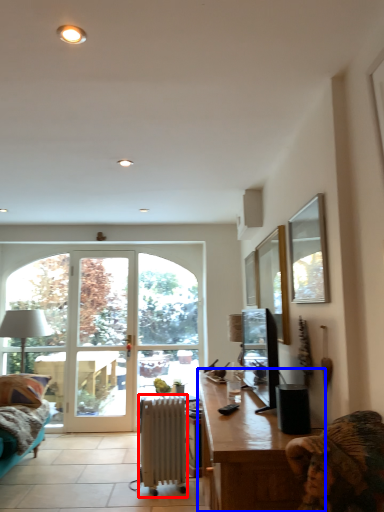
Question: Which point is closer to the camera, radiator (highlighted by a red box) or desk (highlighted by a blue box)?

Choices:
 (A) radiator
 (B) desk

Answer: (B)